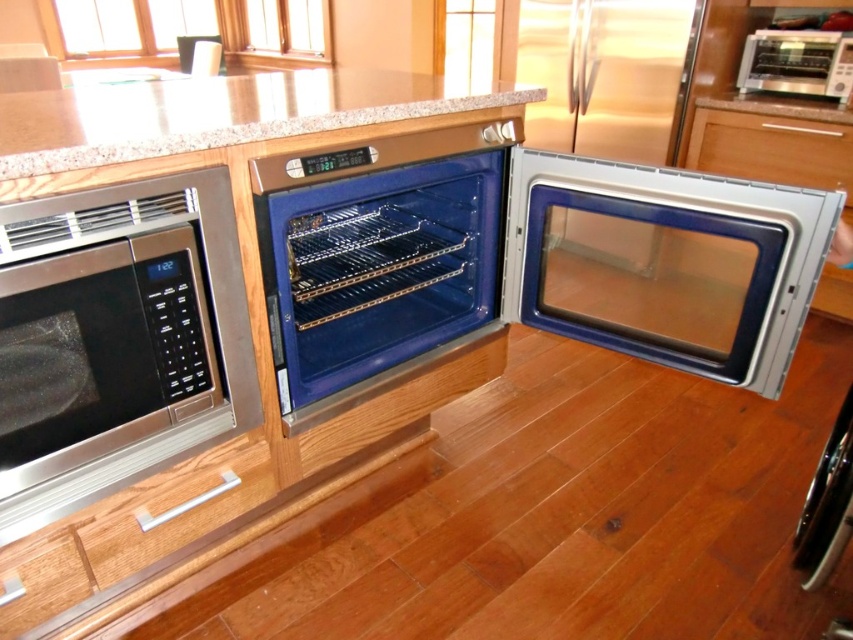
Does stainless steel microwave at left have a larger size compared to granite at upper center?

No.

Which is above, stainless steel microwave at left or granite at upper center?

granite at upper center

What do you see at coordinates (117, 340) in the screenshot? This screenshot has height=640, width=853. I see `stainless steel microwave at left` at bounding box center [117, 340].

Identify the location of stainless steel microwave at left. The height and width of the screenshot is (640, 853). (117, 340).

Based on the photo, is stainless steel microwave at left thinner than white wood drawer at lower center?

Correct, stainless steel microwave at left's width is less than white wood drawer at lower center's.

Between point (62, 392) and point (114, 557), which one is positioned behind?

The point (114, 557) is behind.

You are a GUI agent. You are given a task and a screenshot of the screen. Output one action in this format:
    pyautogui.click(x=<x>, y=<y>)
    Task: Click on the stainless steel microwave at left
    The width and height of the screenshot is (853, 640).
    Given the screenshot: What is the action you would take?
    pyautogui.click(x=117, y=340)

Does point (322, 83) come in front of point (625, 124)?

Yes, it is in front of point (625, 124).

Locate an element on the screen. This screenshot has height=640, width=853. granite at upper center is located at coordinates (219, 113).

The height and width of the screenshot is (640, 853). What are the coordinates of `granite at upper center` in the screenshot? It's located at (219, 113).